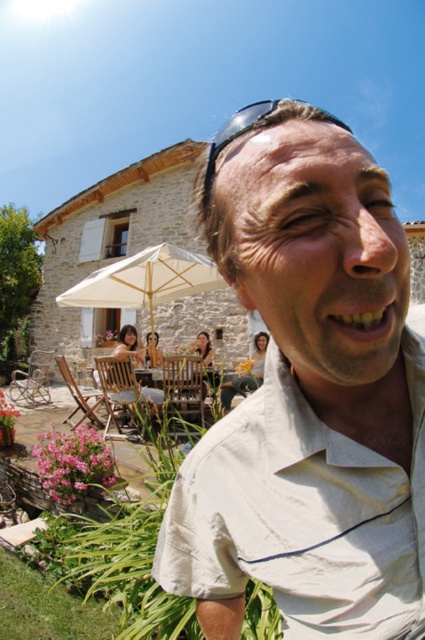
You are a photographer standing in the scene and want to capture a photo where both the beige cotton shirt at center and the beige fabric umbrella at center are visible. Which object should you ensure is closer to the camera to include both in the frame without cropping?

The beige cotton shirt at center is shorter than the beige fabric umbrella at center. To include both without cropping, position the camera closer to the beige cotton shirt at center so its smaller size fills the frame adequately while still capturing the taller umbrella in the background.

You are a fashion designer observing the scene and want to create a new outfit. Based on the beige cotton shirt at center and sunglasses at upper center, which item is narrower in width?

The beige cotton shirt at center is narrower in width compared to the sunglasses at upper center.